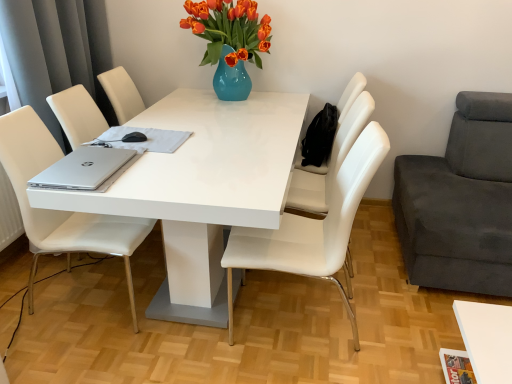
This screenshot has height=384, width=512. Identify the location of free space above silver metallic laptop at left (from a real-world perspective). (88, 162).